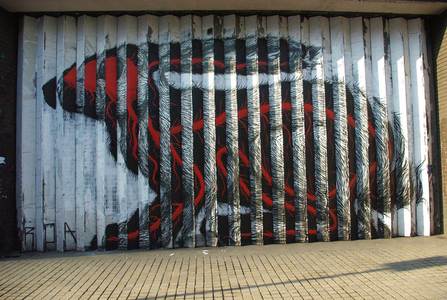
Locate an element on the screen. This screenshot has width=447, height=300. black wall is located at coordinates (5, 126).